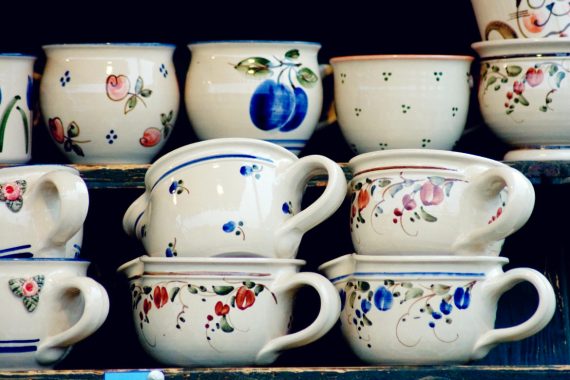
Identify the location of mug handles. This screenshot has height=380, width=570. (87, 316), (69, 216), (327, 209), (329, 297), (517, 209), (544, 298), (324, 65), (36, 77).